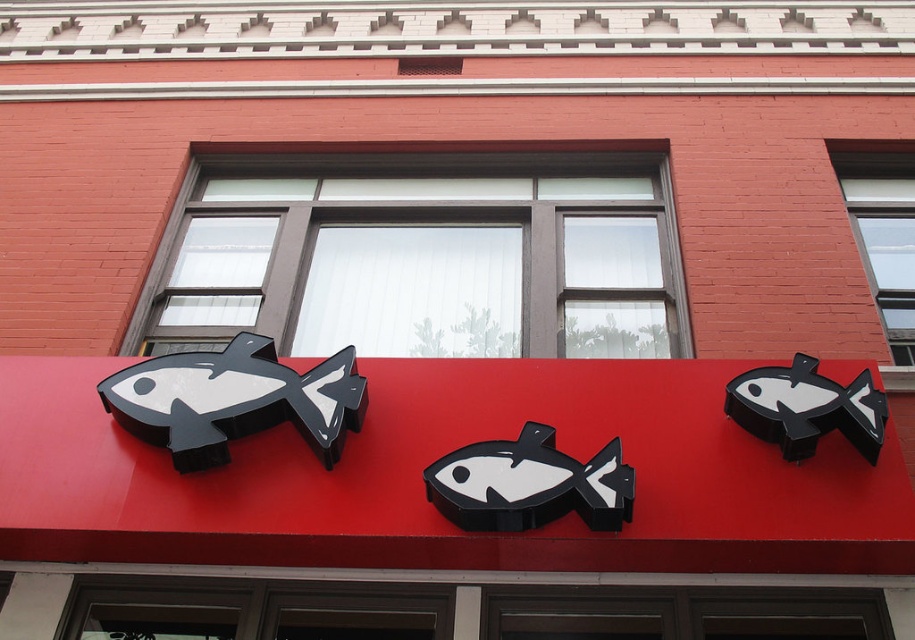
Does matte black fish at center have a larger size compared to black matte fish at upper right?

Correct, matte black fish at center is larger in size than black matte fish at upper right.

Which is in front, point (229, 380) or point (786, 445)?

Point (786, 445) is in front.

Locate an element on the screen. The image size is (915, 640). matte black fish at center is located at coordinates (235, 401).

This screenshot has height=640, width=915. I want to click on matte black fish at center, so click(235, 401).

Does black matte fish at center have a greater width compared to black matte fish at upper right?

Yes, black matte fish at center is wider than black matte fish at upper right.

Does point (561, 488) come closer to viewer compared to point (837, 426)?

Yes, point (561, 488) is in front of point (837, 426).

This screenshot has width=915, height=640. I want to click on black matte fish at center, so click(529, 484).

Is matte black fish at center further to camera compared to black matte fish at center?

Yes, it is.

Which is more to the right, matte black fish at center or black matte fish at center?

black matte fish at center is more to the right.

Which is in front, point (137, 413) or point (553, 445)?

Point (553, 445) is in front.

Image resolution: width=915 pixels, height=640 pixels. I want to click on matte black fish at center, so click(x=235, y=401).